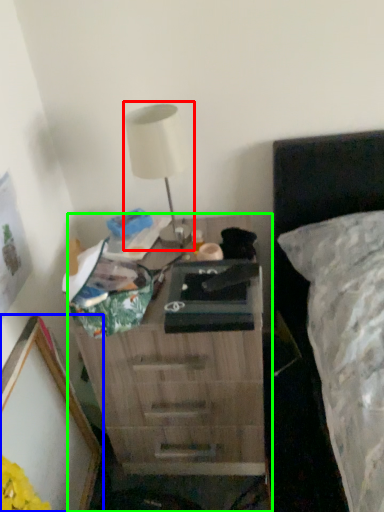
Question: Which object is positioned farthest from table lamp (highlighted by a red box)? Select from picture frame (highlighted by a blue box) and nightstand (highlighted by a green box).

Choices:
 (A) picture frame
 (B) nightstand

Answer: (A)